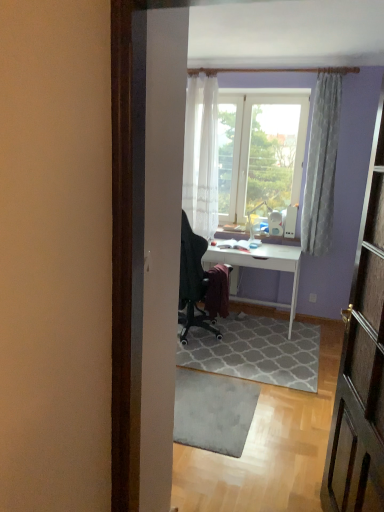
This screenshot has width=384, height=512. I want to click on free spot above gray textured rug at center, which is the 2th doormat from back to front (from a real-world perspective), so click(x=209, y=400).